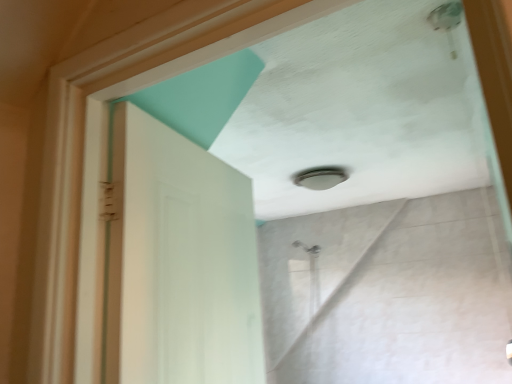
Image resolution: width=512 pixels, height=384 pixels. What do you see at coordinates (179, 262) in the screenshot? I see `white matte door at center` at bounding box center [179, 262].

You are a GUI agent. You are given a task and a screenshot of the screen. Output one action in this format:
    pyautogui.click(x=<x>, y=<y>)
    Task: Click on the white matte door at center
    Image resolution: width=512 pixels, height=384 pixels.
    Given the screenshot: What is the action you would take?
    pyautogui.click(x=179, y=262)

Image resolution: width=512 pixels, height=384 pixels. I want to click on white matte door at center, so click(x=179, y=262).